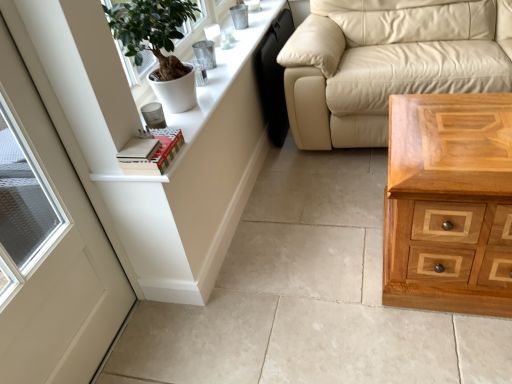
Question: From a real-world perspective, is white wood dresser at upper left beneath white matte door at left?

Choices:
 (A) yes
 (B) no

Answer: (B)

Question: Is white wood dresser at upper left smaller than white matte door at left?

Choices:
 (A) yes
 (B) no

Answer: (A)

Question: Is white wood dresser at upper left behind white matte door at left?

Choices:
 (A) yes
 (B) no

Answer: (A)

Question: Is white wood dresser at upper left positioned with its back to white matte door at left?

Choices:
 (A) yes
 (B) no

Answer: (B)

Question: Does white wood dresser at upper left appear on the left side of white matte door at left?

Choices:
 (A) yes
 (B) no

Answer: (B)

Question: Looking at the image, does white wood dresser at upper left seem bigger or smaller compared to beige leather couch at upper right?

Choices:
 (A) big
 (B) small

Answer: (B)

Question: Is point (152, 223) positioned closer to the camera than point (437, 81)?

Choices:
 (A) closer
 (B) farther

Answer: (A)

Question: Is white wood dresser at upper left to the left or to the right of beige leather couch at upper right in the image?

Choices:
 (A) right
 (B) left

Answer: (B)

Question: Considering their positions, is white wood dresser at upper left located in front of or behind beige leather couch at upper right?

Choices:
 (A) behind
 (B) front

Answer: (B)

Question: Considering their positions, is white wood dresser at upper left located in front of or behind hardcover book at upper left?

Choices:
 (A) behind
 (B) front

Answer: (A)

Question: Choose the correct answer: Is white wood dresser at upper left inside hardcover book at upper left or outside it?

Choices:
 (A) outside
 (B) inside

Answer: (A)

Question: In terms of height, does white wood dresser at upper left look taller or shorter compared to hardcover book at upper left?

Choices:
 (A) short
 (B) tall

Answer: (A)

Question: Is white wood dresser at upper left wider or thinner than hardcover book at upper left?

Choices:
 (A) wide
 (B) thin

Answer: (A)

Question: Is white matte pot at upper left bigger or smaller than beige leather couch at upper right?

Choices:
 (A) big
 (B) small

Answer: (B)

Question: Is white matte pot at upper left inside or outside of beige leather couch at upper right?

Choices:
 (A) outside
 (B) inside

Answer: (A)